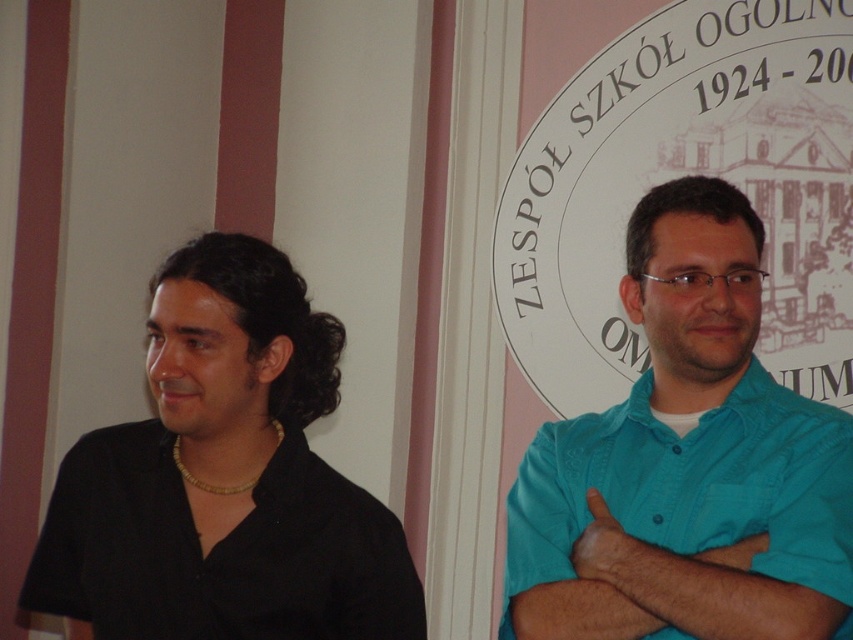
You are designing a poster for a school event and need to arrange two shirts as part of the design. The shirts are the teal cotton shirt at right and the black matte shirt at left. According to the image, which shirt should you place higher up on the poster to maintain their relative positions?

The teal cotton shirt at right should be placed higher up on the poster since it is much taller than the black matte shirt at left in the image.

You are an interior designer planning to hang a small painting on the wall. The painting is 15 cm wide and you want to place it to the left of the teal cotton shirt at right. Where should you position the painting to ensure it aligns horizontally with the shirt?

The teal cotton shirt at right is located at point (688, 464). To align the painting horizontally, place it at the same y coordinate of 0.807 but to the left of the shirt. The x coordinate should be less than 0.725, ensuring the painting is positioned to the left while maintaining the same vertical alignment.

You are a fashion designer observing the scene. You need to determine which shirt is visible on top between the teal cotton shirt at right and the black matte shirt at left. Which one is on top?

The teal cotton shirt at right is positioned over the black matte shirt at left, so the teal cotton shirt at right is visible on top.